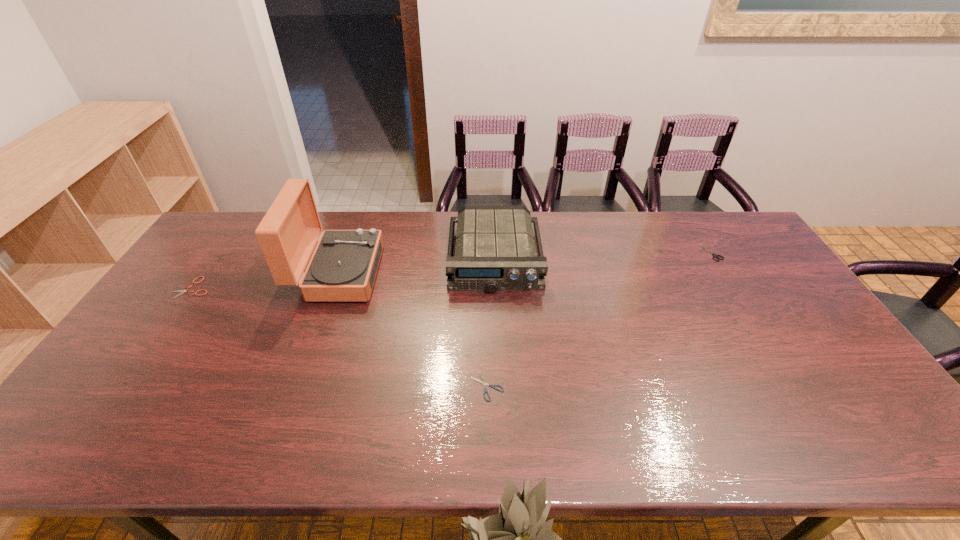
Locate an element on the screen. This screenshot has height=540, width=960. vacant space located 0.060m on the front panel of the radio receiver is located at coordinates [497, 309].

Locate an element on the screen. The width and height of the screenshot is (960, 540). vacant space located on the left of the third tallest object is located at coordinates (608, 252).

Identify the location of free point located 0.140m on the back of the second nearest shears. (219, 249).

You are a GUI agent. You are given a task and a screenshot of the screen. Output one action in this format:
    pyautogui.click(x=<x>, y=<y>)
    Task: Click on the free region located 0.330m on the right of the second shears from right to left
    
    Given the screenshot: What is the action you would take?
    pyautogui.click(x=636, y=387)

I want to click on phonograph record at the far edge, so click(x=343, y=267).

You are a GUI agent. You are given a task and a screenshot of the screen. Output one action in this format:
    pyautogui.click(x=<x>, y=<y>)
    Task: Click on the radio receiver at the far edge
    
    Given the screenshot: What is the action you would take?
    pyautogui.click(x=495, y=250)

I want to click on shears present at the far edge, so click(715, 255).

Find the location of `object at the left edge`. object at the left edge is located at coordinates (182, 291).

Identify the location of object at the right edge. point(715,255).

Identify the location of object that is at the far right corner. (715, 255).